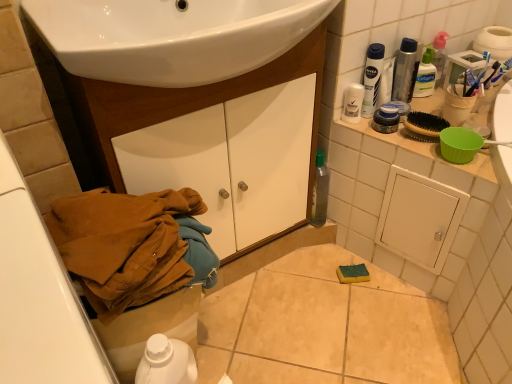
This screenshot has height=384, width=512. What do you see at coordinates (149, 329) in the screenshot? I see `white plastic toilet bowl at lower left` at bounding box center [149, 329].

The height and width of the screenshot is (384, 512). What do you see at coordinates (479, 75) in the screenshot?
I see `blue plastic toothbrush at upper right` at bounding box center [479, 75].

Describe the element at coordinates (182, 103) in the screenshot. I see `wooden cabinet at lower left` at that location.

The image size is (512, 384). Identify the location of white plastic toilet bowl at lower left. (149, 329).

Which of these two, blue glossy jar at upper right, which is the second mouthwash from top to bottom, or metallic silver spray can at upper right, is bigger?

Bigger between the two is metallic silver spray can at upper right.

From the image's perspective, which is above, blue glossy jar at upper right, which is the second mouthwash from top to bottom, or metallic silver spray can at upper right?

metallic silver spray can at upper right is shown above in the image.

Can you confirm if blue glossy jar at upper right, marked as the 1th mouthwash in a bottom-to-top arrangement, is wider than metallic silver spray can at upper right?

Indeed, blue glossy jar at upper right, marked as the 1th mouthwash in a bottom-to-top arrangement, has a greater width compared to metallic silver spray can at upper right.

Considering the sizes of metallic silver spray can at upper right and wooden cabinet at lower left in the image, is metallic silver spray can at upper right taller or shorter than wooden cabinet at lower left?

metallic silver spray can at upper right is shorter than wooden cabinet at lower left.

How much distance is there between metallic silver spray can at upper right and wooden cabinet at lower left?

20.20 inches.

Is wooden cabinet at lower left located within metallic silver spray can at upper right?

Definitely not — wooden cabinet at lower left is not inside metallic silver spray can at upper right.

Considering the relative positions of metallic silver spray can at upper right and wooden cabinet at lower left in the image provided, is metallic silver spray can at upper right to the right of wooden cabinet at lower left from the viewer's perspective?

Yes.

Is clear plastic bottle at upper right, the first toiletry in the right-to-left sequence, oriented away from white plastic bottle at upper right, which ranks as the 1th mouthwash in top-to-bottom order?

No, clear plastic bottle at upper right, the first toiletry in the right-to-left sequence,'s orientation is not away from white plastic bottle at upper right, which ranks as the 1th mouthwash in top-to-bottom order.

Which point is more distant from viewer, [418,97] or [383,45]?

The point [418,97] is farther.

Considering the sizes of objects clear plastic bottle at upper right, the second toiletry in the bottom-to-top sequence, and white plastic bottle at upper right, which ranks as the 1th mouthwash in top-to-bottom order, in the image provided, who is taller, clear plastic bottle at upper right, the second toiletry in the bottom-to-top sequence, or white plastic bottle at upper right, which ranks as the 1th mouthwash in top-to-bottom order,?

white plastic bottle at upper right, which ranks as the 1th mouthwash in top-to-bottom order, is taller.

Is clear plastic bottle at upper right, acting as the 1th toiletry starting from the top, completely or partially outside of white plastic bottle at upper right, which ranks as the 1th mouthwash in top-to-bottom order?

Absolutely, clear plastic bottle at upper right, acting as the 1th toiletry starting from the top, is external to white plastic bottle at upper right, which ranks as the 1th mouthwash in top-to-bottom order.

Is translucent plastic pump bottle at upper right at the back of blue glossy jar at upper right, marked as the 1th mouthwash in a bottom-to-top arrangement?

No, translucent plastic pump bottle at upper right is not at the back of blue glossy jar at upper right, marked as the 1th mouthwash in a bottom-to-top arrangement.

How different are the orientations of blue glossy jar at upper right, which is the second mouthwash from top to bottom, and translucent plastic pump bottle at upper right in degrees?

0.00136 degrees separate the facing orientations of blue glossy jar at upper right, which is the second mouthwash from top to bottom, and translucent plastic pump bottle at upper right.

Considering the positions of points (390, 114) and (431, 52), is point (390, 114) closer to camera compared to point (431, 52)?

Yes, point (390, 114) is closer to viewer.

In terms of width, does blue glossy jar at upper right, marked as the 1th mouthwash in a bottom-to-top arrangement, look wider or thinner when compared to translucent plastic pump bottle at upper right?

blue glossy jar at upper right, marked as the 1th mouthwash in a bottom-to-top arrangement, is wider than translucent plastic pump bottle at upper right.

Does white plastic bottle at upper right, placed as the second mouthwash when sorted from bottom to top, have a larger size compared to blue plastic toothbrush at upper right?

Correct, white plastic bottle at upper right, placed as the second mouthwash when sorted from bottom to top, is larger in size than blue plastic toothbrush at upper right.

Considering the relative positions of white plastic bottle at upper right, which ranks as the 1th mouthwash in top-to-bottom order, and blue plastic toothbrush at upper right in the image provided, is white plastic bottle at upper right, which ranks as the 1th mouthwash in top-to-bottom order, to the left of blue plastic toothbrush at upper right from the viewer's perspective?

Indeed, white plastic bottle at upper right, which ranks as the 1th mouthwash in top-to-bottom order, is positioned on the left side of blue plastic toothbrush at upper right.

Which is correct: white plastic bottle at upper right, which ranks as the 1th mouthwash in top-to-bottom order, is inside blue plastic toothbrush at upper right, or outside of it?

white plastic bottle at upper right, which ranks as the 1th mouthwash in top-to-bottom order, is not inside blue plastic toothbrush at upper right, it's outside.

From the image's perspective, which is below, white plastic bottle at upper right, placed as the second mouthwash when sorted from bottom to top, or blue plastic toothbrush at upper right?

blue plastic toothbrush at upper right is shown below in the image.

Is wooden cabinet at lower left to the left or to the right of blue plastic toothbrush at upper right in the image?

In the image, wooden cabinet at lower left appears on the left side of blue plastic toothbrush at upper right.

Is wooden cabinet at lower left completely or partially outside of blue plastic toothbrush at upper right?

wooden cabinet at lower left is positioned outside blue plastic toothbrush at upper right.

From a real-world perspective, is wooden cabinet at lower left located beneath blue plastic toothbrush at upper right?

Indeed, from a real-world perspective, wooden cabinet at lower left is positioned beneath blue plastic toothbrush at upper right.

Is wooden cabinet at lower left aimed at blue plastic toothbrush at upper right?

No, wooden cabinet at lower left is not oriented towards blue plastic toothbrush at upper right.

Considering the positions of objects wooden cabinet at lower left and metallic silver spray can at upper right in the image provided, who is behind, wooden cabinet at lower left or metallic silver spray can at upper right?

metallic silver spray can at upper right is further from the camera.

Is wooden cabinet at lower left not close to metallic silver spray can at upper right?

Actually, wooden cabinet at lower left and metallic silver spray can at upper right are a little close together.

I want to click on bathroom cabinet on the left of metallic silver spray can at upper right, so click(x=182, y=103).

I want to click on bottle above the blue glossy jar at upper right, which is the second mouthwash from top to bottom (from the image's perspective), so click(405, 71).

The width and height of the screenshot is (512, 384). In the image, there is a metallic silver spray can at upper right. What are the coordinates of `bathroom cabinet below it (from the image's perspective)` in the screenshot? It's located at 182,103.

Which object lies nearer to the anchor point white plastic toilet bowl at lower left, white matte deodorant stick at upper right, which ranks as the 2th toiletry in right-to-left order, or metallic silver spray can at upper right?

white matte deodorant stick at upper right, which ranks as the 2th toiletry in right-to-left order, is positioned closer to the anchor white plastic toilet bowl at lower left.

From the image, which object appears to be farther from translucent plastic pump bottle at upper right, blue glossy jar at upper right, which is the second mouthwash from top to bottom, or blue plastic toothbrush at upper right?

blue glossy jar at upper right, which is the second mouthwash from top to bottom, is further to translucent plastic pump bottle at upper right.

When comparing their distances from white matte deodorant stick at upper right, the 1th toiletry ordered from the bottom, does white plastic toilet bowl at lower left or blue glossy jar at upper right, which is the second mouthwash from top to bottom, seem further?

white plastic toilet bowl at lower left lies further to white matte deodorant stick at upper right, the 1th toiletry ordered from the bottom, than the other object.

Estimate the real-world distances between objects in this image. Which object is further from white matte deodorant stick at upper right, which ranks as the 2th toiletry in right-to-left order, white plastic bottle at upper right, placed as the second mouthwash when sorted from bottom to top, or clear plastic bottle at upper right, the first toiletry in the right-to-left sequence?

clear plastic bottle at upper right, the first toiletry in the right-to-left sequence, is further to white matte deodorant stick at upper right, which ranks as the 2th toiletry in right-to-left order.

Which object lies further to the anchor point metallic silver spray can at upper right, translucent plastic pump bottle at upper right or clear plastic bottle at upper right, the second toiletry in the bottom-to-top sequence?

translucent plastic pump bottle at upper right is further to metallic silver spray can at upper right.

Based on their spatial positions, is wooden cabinet at lower left or translucent plastic pump bottle at upper right closer to white plastic toilet bowl at lower left?

wooden cabinet at lower left.

Based on their spatial positions, is clear plastic bottle at upper right, marked as the second toiletry in a front-to-back arrangement, or blue glossy jar at upper right, marked as the 1th mouthwash in a bottom-to-top arrangement, further from translucent plastic pump bottle at upper right?

blue glossy jar at upper right, marked as the 1th mouthwash in a bottom-to-top arrangement, lies further to translucent plastic pump bottle at upper right than the other object.

Based on their spatial positions, is blue plastic toothbrush at upper right or white matte deodorant stick at upper right, arranged as the 2th toiletry when viewed from the top, further from translucent plastic pump bottle at upper right?

white matte deodorant stick at upper right, arranged as the 2th toiletry when viewed from the top, lies further to translucent plastic pump bottle at upper right than the other object.

I want to click on toiletry between wooden cabinet at lower left and blue glossy jar at upper right, which is the second mouthwash from top to bottom, in the horizontal direction, so click(352, 103).

What are the coordinates of `toiletry situated between metallic silver spray can at upper right and translucent plastic pump bottle at upper right from left to right` in the screenshot? It's located at (425, 76).

Identify the location of toiletry located between white matte deodorant stick at upper right, the first toiletry when ordered from front to back, and blue plastic toothbrush at upper right in the left-right direction. (425, 76).

Where is `bottle between white matte deodorant stick at upper right, the first toiletry when ordered from front to back, and translucent plastic pump bottle at upper right, in the horizontal direction`? This screenshot has height=384, width=512. bottle between white matte deodorant stick at upper right, the first toiletry when ordered from front to back, and translucent plastic pump bottle at upper right, in the horizontal direction is located at coordinates (405, 71).